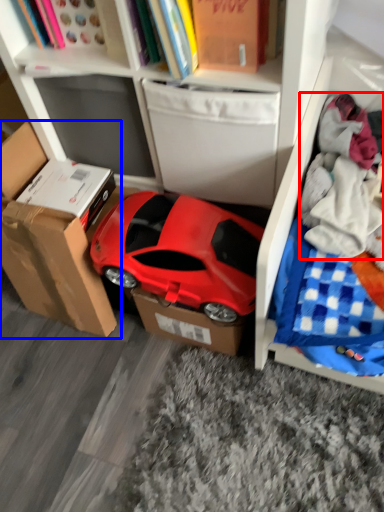
Question: Which object appears farthest to the camera in this image, clothing (highlighted by a red box) or cardboard box (highlighted by a blue box)?

Choices:
 (A) clothing
 (B) cardboard box

Answer: (B)